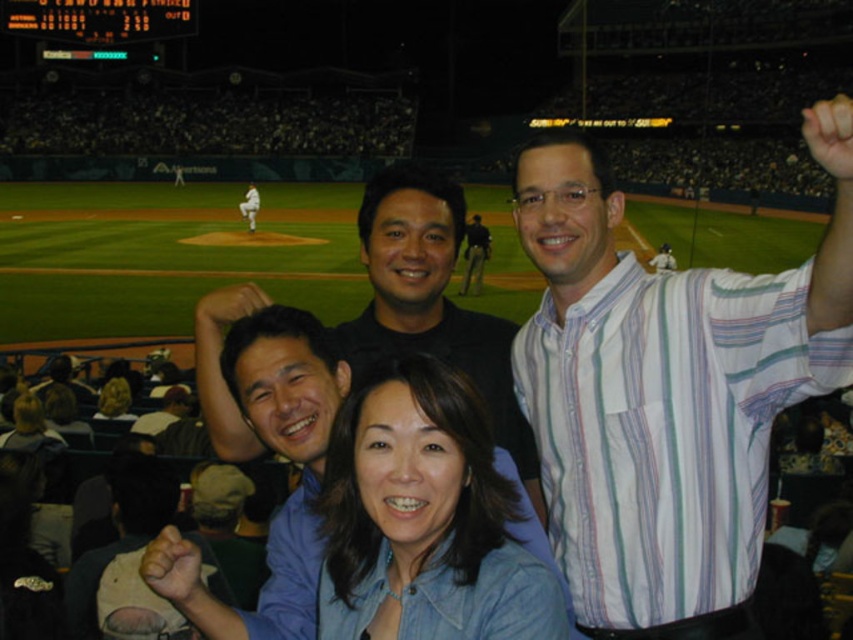
You are a photographer at the baseball stadium and want to ensure both the denim shirt at lower center and the black matte shirt at center are fully visible in your photo. Which shirt should you focus on to ensure both are in frame without cropping?

The denim shirt at lower center has a lesser width compared to the black matte shirt at center, so you should focus on the black matte shirt at center to ensure both are in frame without cropping.

You are standing at the entrance of the baseball stadium and see the denim shirt at lower center and the black matte shirt at center. Which person is closer to you?

The denim shirt at lower center is closer to the viewer than the black matte shirt at center.

You are a photographer at the baseball stadium. You notice the white striped shirt at upper right and the smooth brown hair at lower center in your frame. Which object is closer to the camera?

The white striped shirt at upper right is closer to the camera because it is positioned over the smooth brown hair at lower center, indicating it is in front.